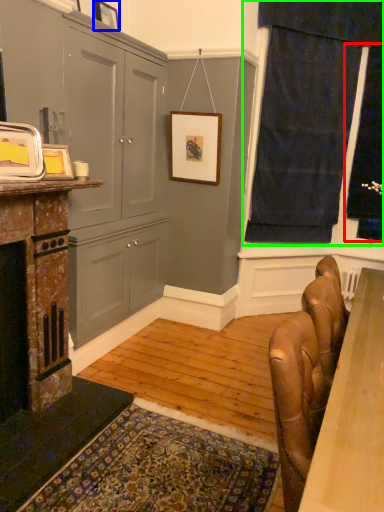
Question: Based on their relative distances, which object is nearer to window screen (highlighted by a red box)? Choose from picture frame (highlighted by a blue box) and curtain (highlighted by a green box).

Choices:
 (A) picture frame
 (B) curtain

Answer: (B)